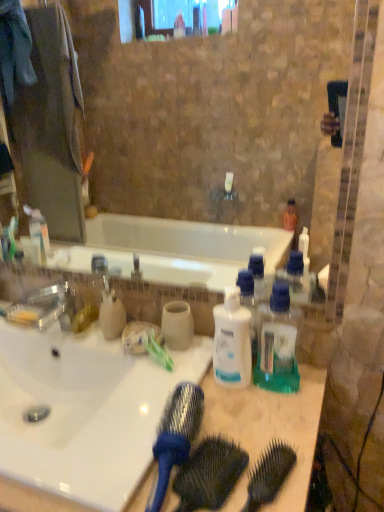
At what (x,y) coordinates should I click in order to perform the action: click on vacant space that's between blue plastic comb at center and white plastic bottle at center, the 2th bottle from the right. Please return your answer as a coordinate pair (x, y). Image resolution: width=384 pixels, height=512 pixels. Looking at the image, I should click on (230, 416).